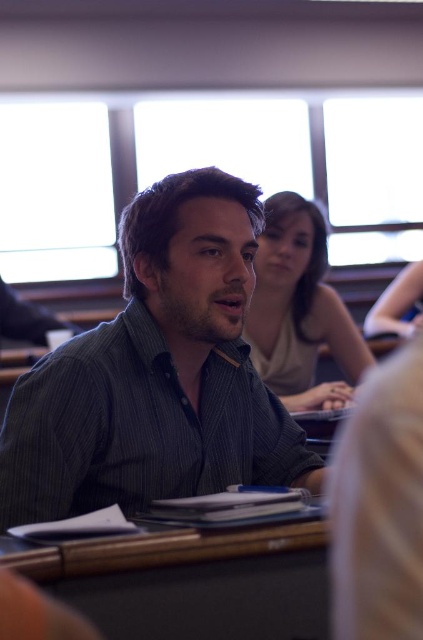
Is black matte table at lower center to the right of matte gray shirt at center from the viewer's perspective?

Incorrect, black matte table at lower center is not on the right side of matte gray shirt at center.

Between black matte table at lower center and matte gray shirt at center, which one has more height?

With more height is matte gray shirt at center.

This screenshot has width=423, height=640. Identify the location of black matte table at lower center. pos(173,586).

Where is `black matte table at lower center`? black matte table at lower center is located at coordinates (173, 586).

Which of these two, dark green striped shirt at center or black matte table at lower center, stands shorter?

With less height is black matte table at lower center.

Does dark green striped shirt at center have a smaller size compared to black matte table at lower center?

Actually, dark green striped shirt at center might be larger than black matte table at lower center.

Who is more distant from viewer, (206, 170) or (143, 593)?

The point (206, 170) is behind.

I want to click on dark green striped shirt at center, so click(x=156, y=372).

Between dark green striped shirt at center and matte gray shirt at center, which one appears on the left side from the viewer's perspective?

dark green striped shirt at center is more to the left.

I want to click on dark green striped shirt at center, so click(156, 372).

You are a GUI agent. You are given a task and a screenshot of the screen. Output one action in this format:
    pyautogui.click(x=<x>, y=<y>)
    Task: Click on the dark green striped shirt at center
    The width and height of the screenshot is (423, 640).
    Given the screenshot: What is the action you would take?
    pyautogui.click(x=156, y=372)

The width and height of the screenshot is (423, 640). I want to click on dark green striped shirt at center, so click(x=156, y=372).